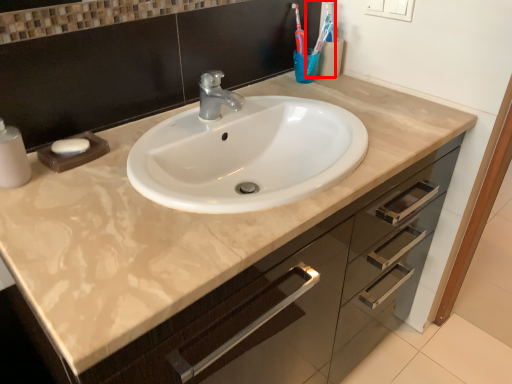
Question: From the image's perspective, what is the correct spatial relationship of toothbrush (annotated by the red box) in relation to soap?

Choices:
 (A) above
 (B) below

Answer: (A)